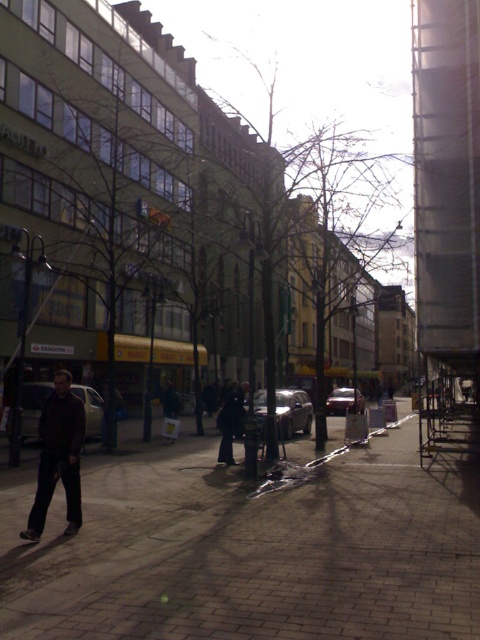
Is brick pavement at center taller than matte black car at center?

Indeed, brick pavement at center has a greater height compared to matte black car at center.

From the picture: Who is more distant from viewer, (83,497) or (27,433)?

Positioned behind is point (27,433).

At what (x,y) coordinates should I click in order to perform the action: click on brick pavement at center. Please return your answer as a coordinate pair (x, y). Looking at the image, I should click on (248, 548).

Measure the distance from black leather pants at center to shiny silver car at center.

The distance of black leather pants at center from shiny silver car at center is 63.98 feet.

Who is positioned more to the right, black leather pants at center or shiny silver car at center?

shiny silver car at center

Between point (217, 417) and point (360, 400), which one is positioned behind?

The point (360, 400) is more distant.

Image resolution: width=480 pixels, height=640 pixels. What are the coordinates of `black leather pants at center` in the screenshot? It's located at (230, 420).

Between satin silver car at center and black leather pants at center, which one appears on the right side from the viewer's perspective?

satin silver car at center

Is point (291, 416) less distant than point (233, 401)?

That is False.

At what (x,y) coordinates should I click in order to perform the action: click on satin silver car at center. Please return your answer as a coordinate pair (x, y). Looking at the image, I should click on (292, 412).

Where is `satin silver car at center`? satin silver car at center is located at coordinates (x=292, y=412).